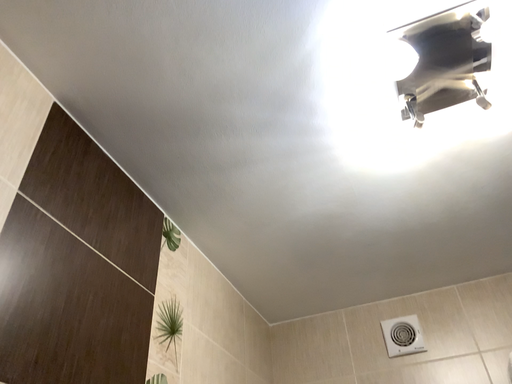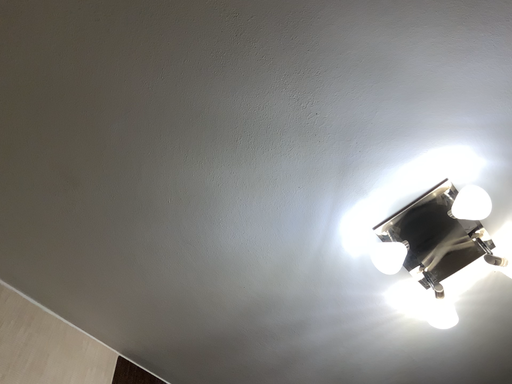
Question: Which way did the camera rotate in the video?

Choices:
 (A) rotated left
 (B) rotated right

Answer: (A)